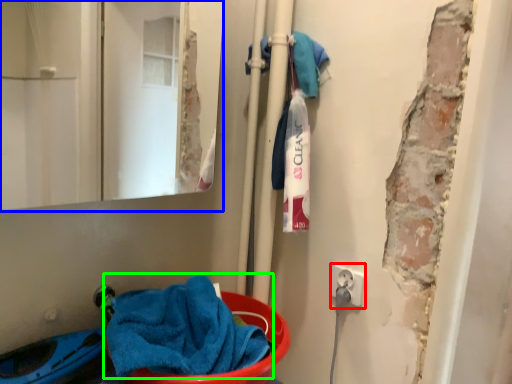
Question: Based on their relative distances, which object is farther from electric outlet (highlighted by a red box)? Choose from mirror (highlighted by a blue box) and towel (highlighted by a green box).

Choices:
 (A) mirror
 (B) towel

Answer: (A)